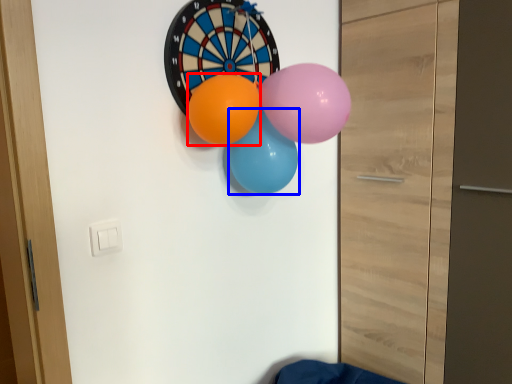
Question: Which object is closer to the camera taking this photo, balloon (highlighted by a red box) or balloon (highlighted by a blue box)?

Choices:
 (A) balloon
 (B) balloon

Answer: (A)